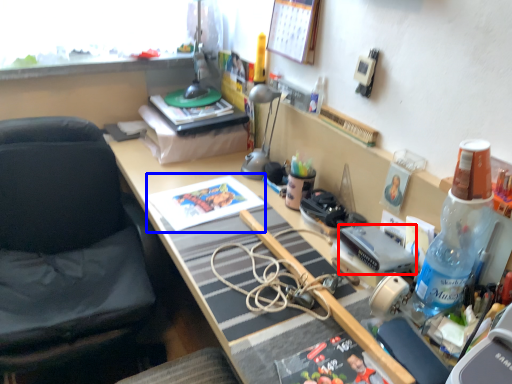
Question: Which object is further to the camera taking this photo, equipment (highlighted by a red box) or paperback book (highlighted by a blue box)?

Choices:
 (A) equipment
 (B) paperback book

Answer: (B)